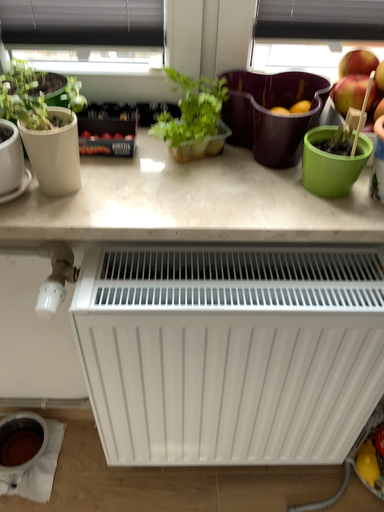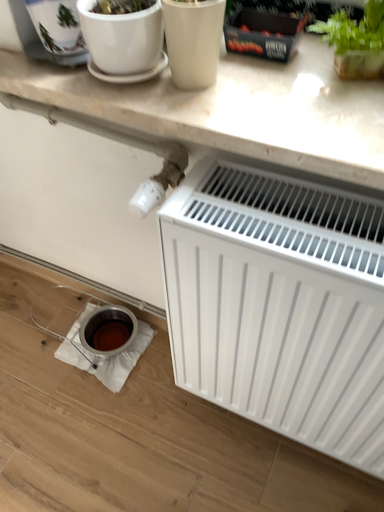
Question: Which way did the camera rotate in the video?

Choices:
 (A) rotated left
 (B) rotated right

Answer: (A)